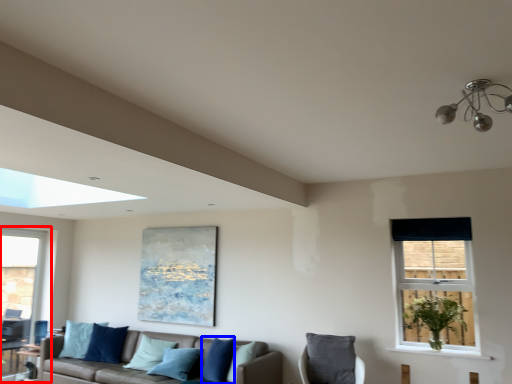
Question: Which object is further to the camera taking this photo, window (highlighted by a red box) or pillow (highlighted by a blue box)?

Choices:
 (A) window
 (B) pillow

Answer: (A)